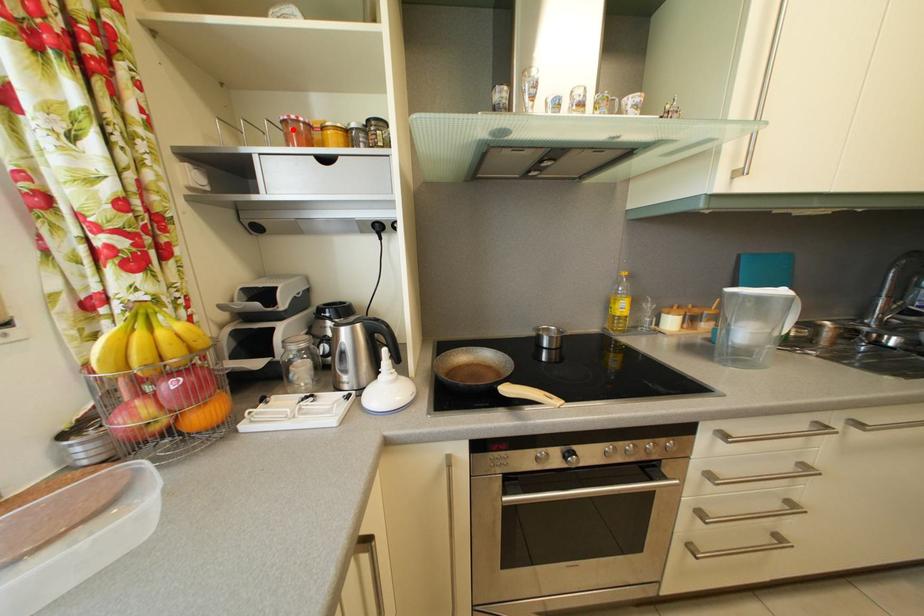
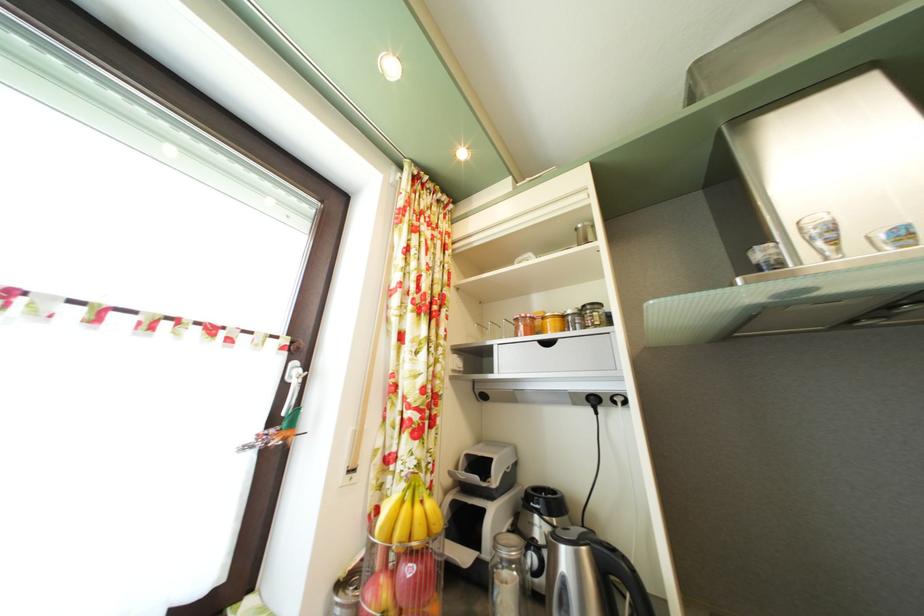
Find the pixel in the second image that matches the highlighted location in the first image.

(525, 326)